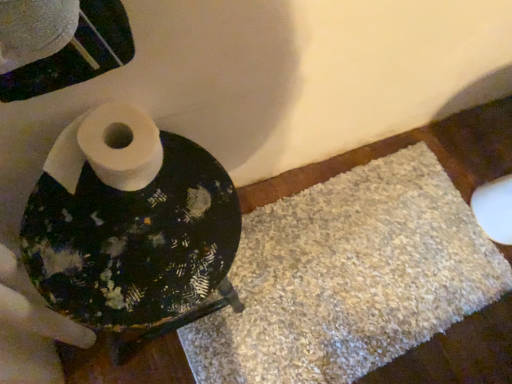
This screenshot has height=384, width=512. I want to click on vacant location below white shaggy bath mat at lower right (from a real-world perspective), so click(x=385, y=256).